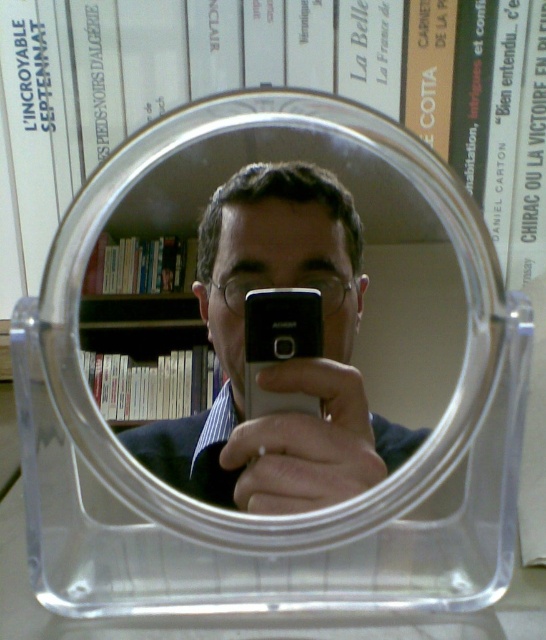
You are a photographer trying to capture the reflection of the clear plastic mirror at center in the image. Based on its 2D coordinates, can you determine if the mirror is positioned closer to the top or bottom edge of the image?

The clear plastic mirror at center is located at coordinates point [364,253], where the second value corresponds to the vertical position. Since 0.668 is closer to 1.0 than to 0.0, the mirror is positioned closer to the bottom edge of the image.

Looking at this image, you are holding a laser pointer and want to aim it at the point marked as point (411,257) in the image. If the laser pointer has a maximum range of 50 centimeters, will it reach that point?

The point (411,257) is 49.35 centimeters from the viewer, so yes, the laser pointer can reach it since its distance is within the 50 cm range.

You are holding a black plastic phone at center and want to take a selfie using the clear plastic mirror at center. Can you see the phone in the mirror?

The clear plastic mirror at center is closer to the viewer than the black plastic phone at center, so yes, the phone will be visible in the mirror as it is positioned behind the mirror.